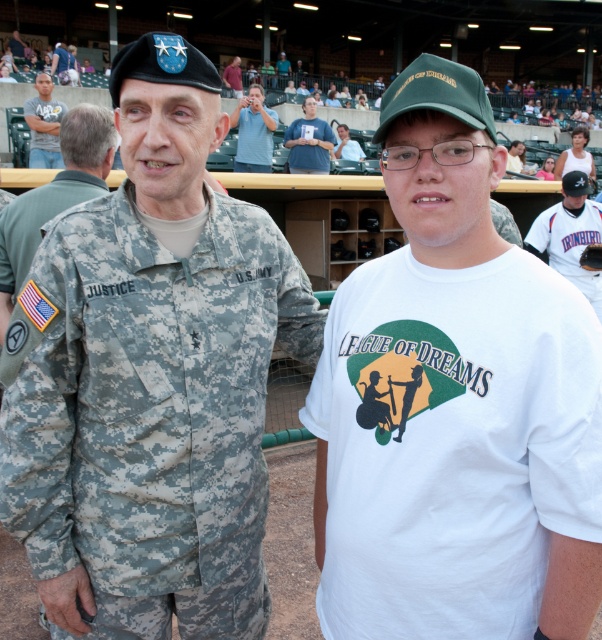
You are a photographer standing at the entrance of the baseball stadium. You want to take a photo of the white jersey at right without moving any objects. Can you capture it in your current position if your camera has a 50mm lens? Explain why or why not.

The white jersey at right is 19.49 feet away from the viewer. A 50mm lens on a full frame camera has a field of view similar to human vision, which can capture subjects at that distance clearly without needing to move closer. Therefore, you can take the photo from your current position.

You are an artist who needs to sketch the scene. You have a white paper at center and a blue denim jacket at upper left. Which object has a smaller width for you to draw?

The white paper at center has a smaller width than the blue denim jacket at upper left, so it is the smaller one to draw.